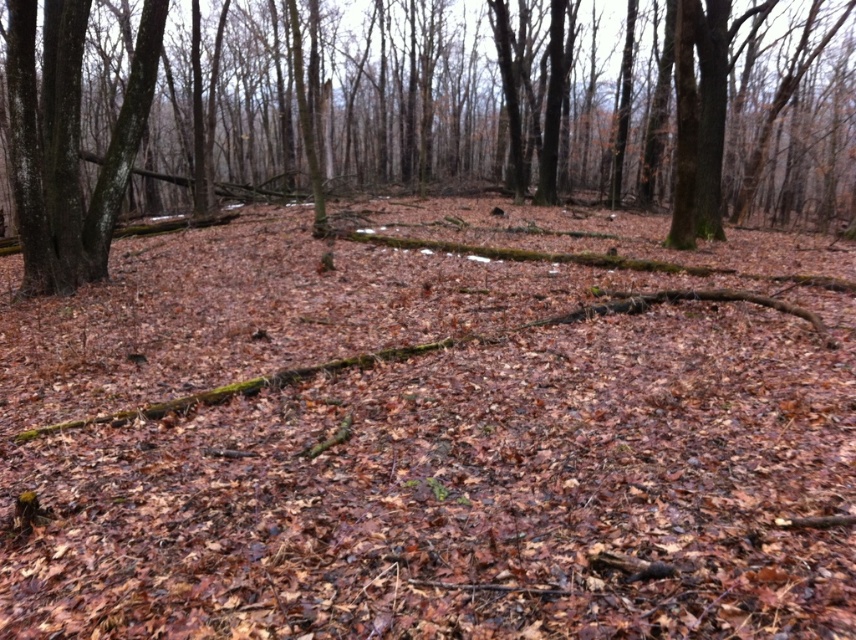
Which is behind, point (458, 93) or point (28, 144)?

Positioned behind is point (458, 93).

Does brown bark tree at center lie behind smooth bark tree at left?

No, it is in front of smooth bark tree at left.

Is point (66, 273) farther from viewer compared to point (162, 35)?

That is False.

This screenshot has width=856, height=640. In order to click on brown bark tree at center in this screenshot , I will do `click(397, 106)`.